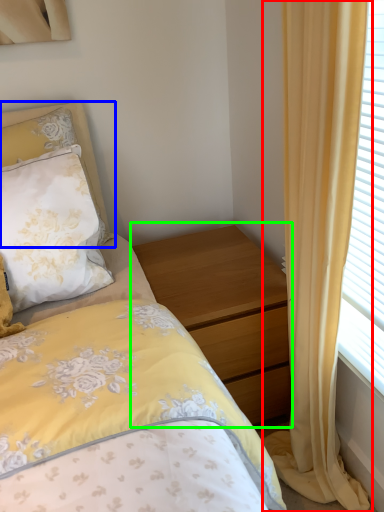
Question: Which is farther away from curtain (highlighted by a red box)? pillow (highlighted by a blue box) or nightstand (highlighted by a green box)?

Choices:
 (A) pillow
 (B) nightstand

Answer: (A)